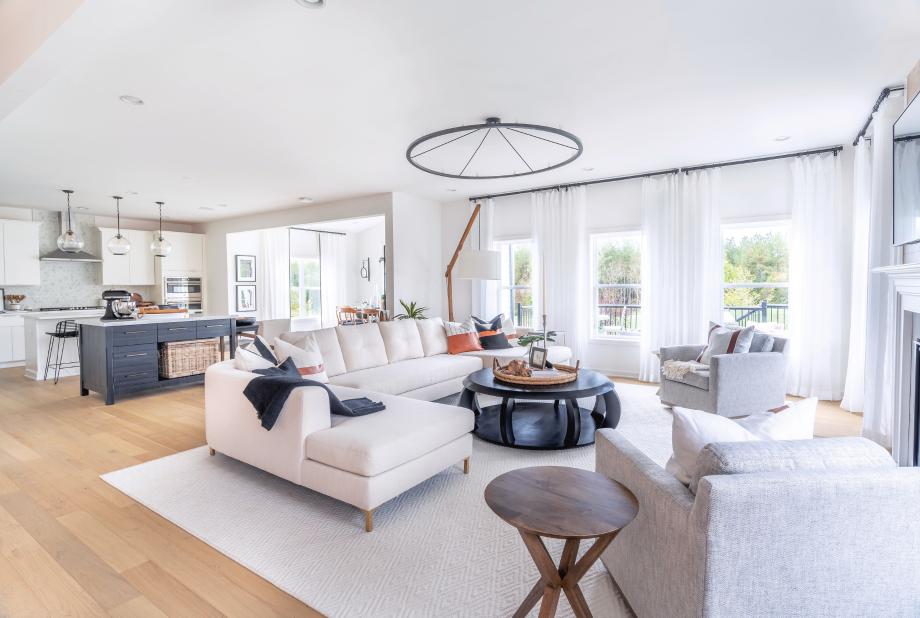
The image size is (920, 618). Find the location of `rug`. rug is located at coordinates (398, 578).